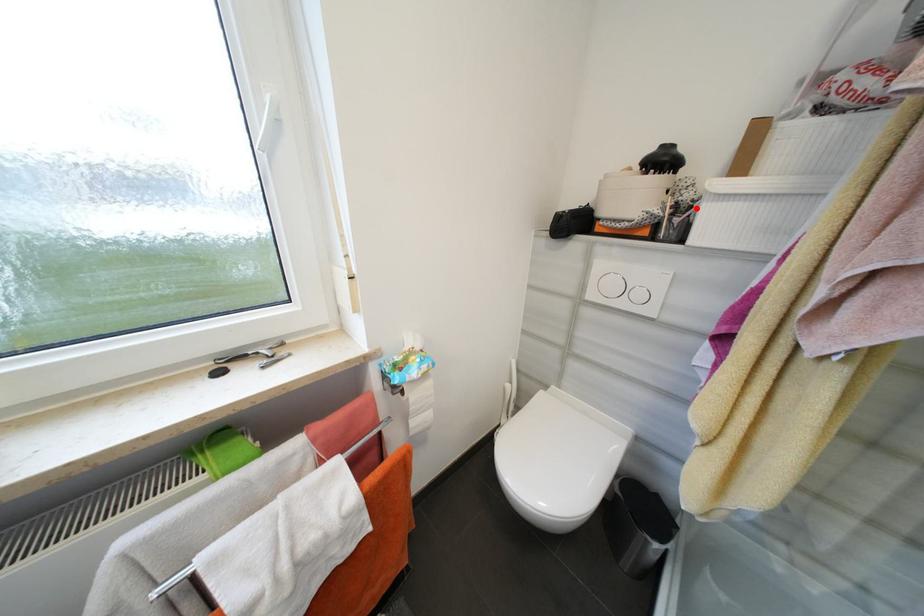
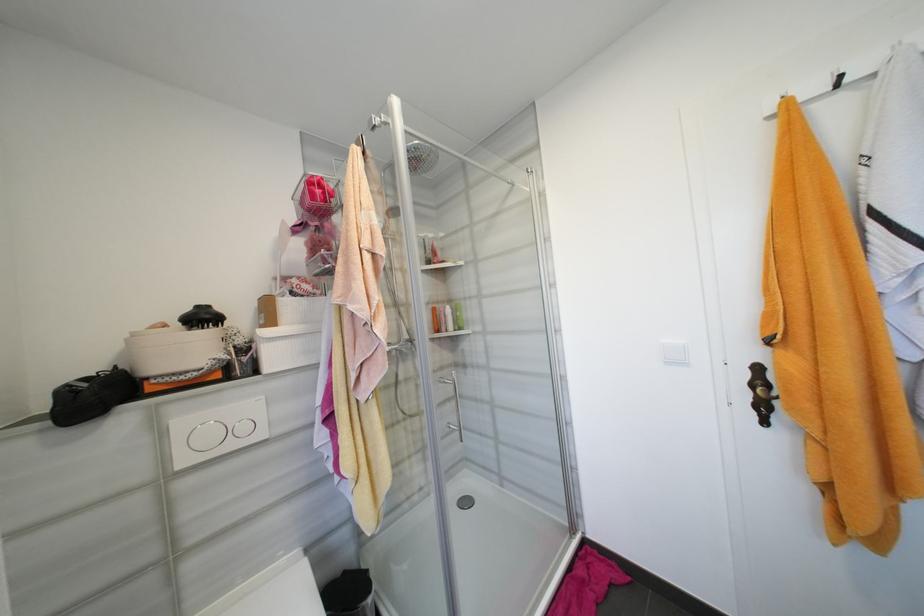
Where in the second image is the point corresponding to the highlighted location from the first image?

(256, 349)